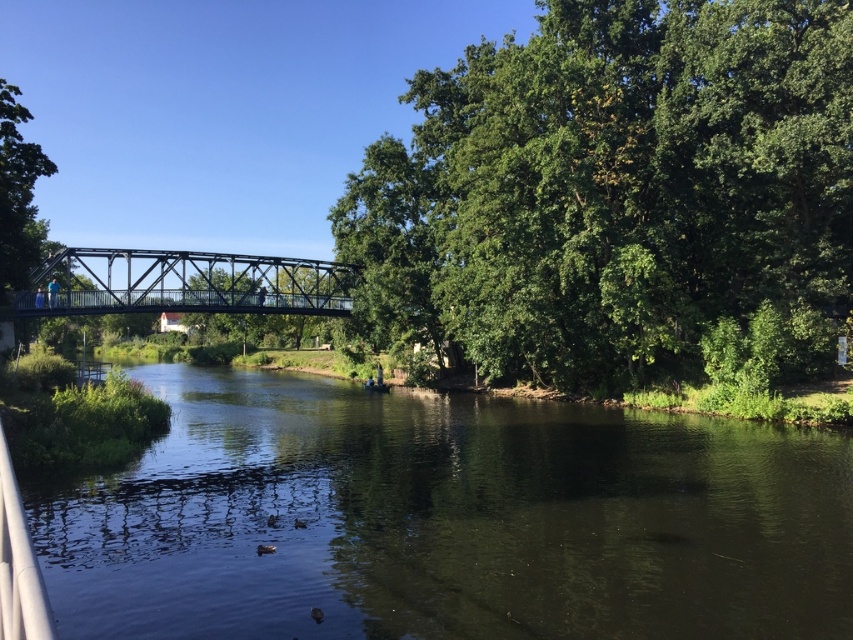
Is the position of dark green water at center more distant than that of green leafy tree at center?

No, dark green water at center is in front of green leafy tree at center.

At what (x,y) coordinates should I click in order to perform the action: click on dark green water at center. Please return your answer as a coordinate pair (x, y). The width and height of the screenshot is (853, 640). Looking at the image, I should click on (445, 520).

Which is below, green leafy tree at center or metallic bridge at center?

metallic bridge at center is below.

Is green leafy tree at center smaller than metallic bridge at center?

No.

Is point (706, 291) closer to viewer compared to point (131, 260)?

Yes, it is in front of point (131, 260).

The height and width of the screenshot is (640, 853). What are the coordinates of `green leafy tree at center` in the screenshot? It's located at (613, 188).

Who is higher up, dark green water at center or metallic bridge at center?

metallic bridge at center

Does dark green water at center appear under metallic bridge at center?

Yes, dark green water at center is below metallic bridge at center.

Describe the element at coordinates (445, 520) in the screenshot. The image size is (853, 640). I see `dark green water at center` at that location.

The height and width of the screenshot is (640, 853). In order to click on dark green water at center in this screenshot , I will do `click(445, 520)`.